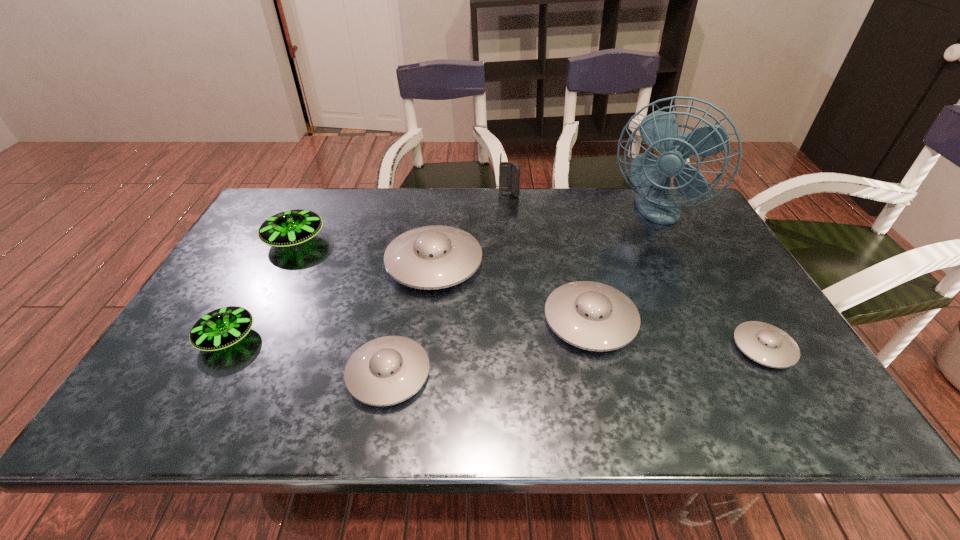
Image resolution: width=960 pixels, height=540 pixels. I want to click on the tallest object, so click(x=659, y=130).

Find the location of a particular element. The image size is (960, 540). the second tallest object is located at coordinates (509, 173).

Where is `the fifth object from left to right`? This screenshot has width=960, height=540. the fifth object from left to right is located at coordinates (509, 173).

The image size is (960, 540). In order to click on the farther green saucer in this screenshot , I will do `click(289, 228)`.

Where is `the biggest gray saucer`? Image resolution: width=960 pixels, height=540 pixels. the biggest gray saucer is located at coordinates (432, 257).

This screenshot has width=960, height=540. What are the coordinates of `the second biggest gray saucer` in the screenshot? It's located at 593,316.

At what (x,y) coordinates should I click in order to perform the action: click on the second saucer from right to left. Please return your answer as a coordinate pair (x, y). The image size is (960, 540). Looking at the image, I should click on (593, 316).

Identify the location of the smaller green saucer. (224, 327).

This screenshot has width=960, height=540. Identify the location of the third biggest gray saucer. (388, 370).

Identify the location of the shortest saucer. The image size is (960, 540). (768, 345).